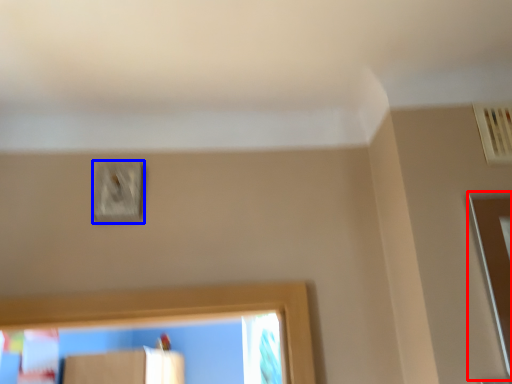
Question: Which of the following is the closest to the observer, screen door (highlighted by a red box) or light switch (highlighted by a blue box)?

Choices:
 (A) screen door
 (B) light switch

Answer: (A)